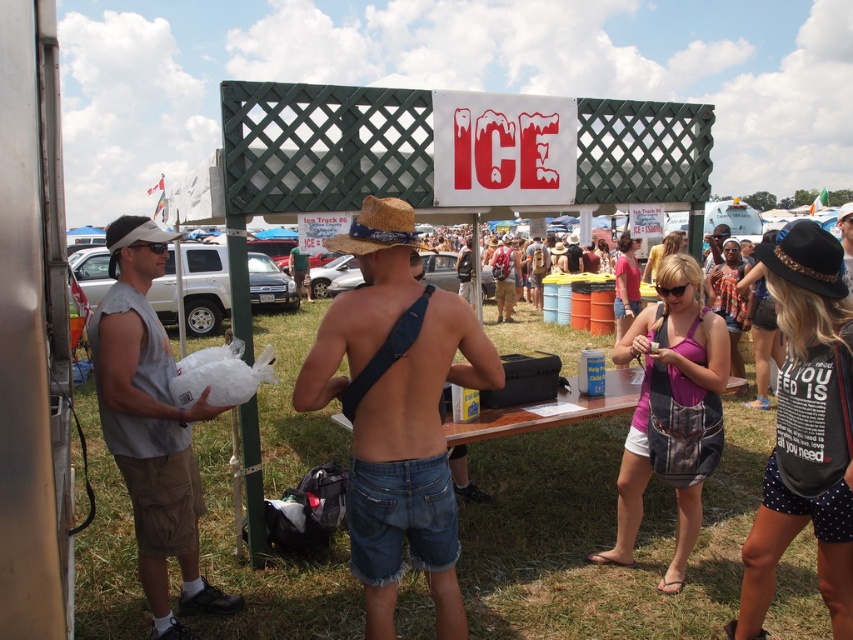
Question: Which of the following is the closest to the observer?

Choices:
 (A) gray fabric shirt at left
 (B) denim shorts at center
 (C) strawhat at center

Answer: (B)

Question: Observing the image, what is the correct spatial positioning of gray fabric shirt at left in reference to strawhat at center?

Choices:
 (A) right
 (B) left

Answer: (B)

Question: Which of these objects is positioned farthest from the strawhat at center?

Choices:
 (A) denim shorts at center
 (B) gray fabric shirt at left

Answer: (B)

Question: Can you confirm if denim shorts at center is wider than strawhat at center?

Choices:
 (A) no
 (B) yes

Answer: (B)

Question: Which point is closer to the camera taking this photo?

Choices:
 (A) (165, 616)
 (B) (376, 205)
 (C) (418, 326)

Answer: (C)

Question: Is denim shorts at center wider than gray fabric shirt at left?

Choices:
 (A) yes
 (B) no

Answer: (A)